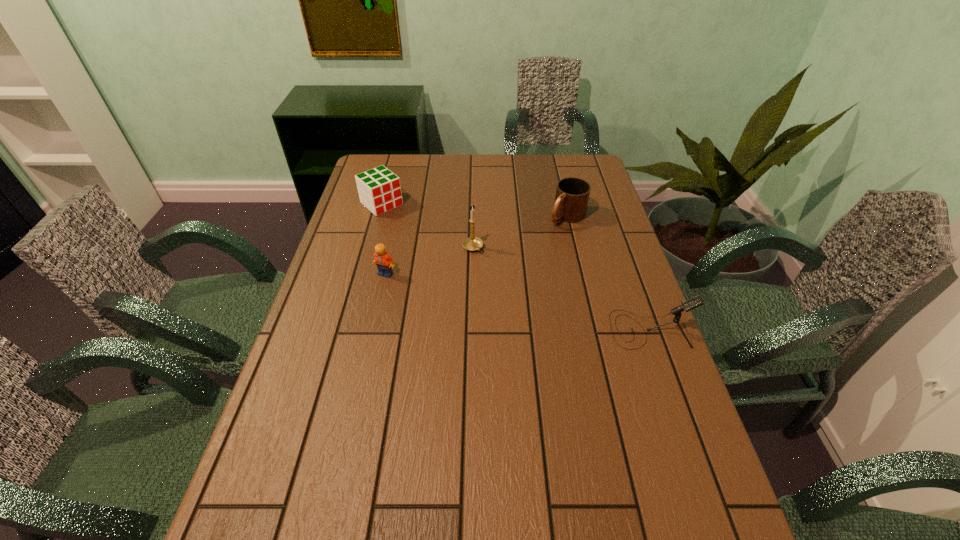
At what (x,y) coordinates should I click in order to perform the action: click on vacant space located 0.200m on the red face of the cube. Please return your answer as a coordinate pair (x, y). Looking at the image, I should click on (426, 242).

What are the coordinates of `vacant region located on the red face of the cube` in the screenshot? It's located at (451, 262).

The image size is (960, 540). Identify the location of free space located on the red face of the cube. (455, 266).

Where is `free space located 0.290m on the handle side of the candle holder`? This screenshot has height=540, width=960. free space located 0.290m on the handle side of the candle holder is located at coordinates (528, 318).

The image size is (960, 540). Identify the location of free space located 0.360m on the handle side of the candle holder. (542, 336).

Find the location of a particular element. The width and height of the screenshot is (960, 540). vacant space situated 0.360m on the handle side of the candle holder is located at coordinates (542, 336).

Where is `vacant space located on the side of the mug with the handle`? vacant space located on the side of the mug with the handle is located at coordinates (531, 246).

The height and width of the screenshot is (540, 960). I want to click on free spot located 0.380m on the side of the mug with the handle, so click(481, 287).

I want to click on vacant space located 0.360m on the side of the mug with the handle, so [x=486, y=283].

The width and height of the screenshot is (960, 540). In order to click on Lego present at the left edge in this screenshot , I will do `click(384, 262)`.